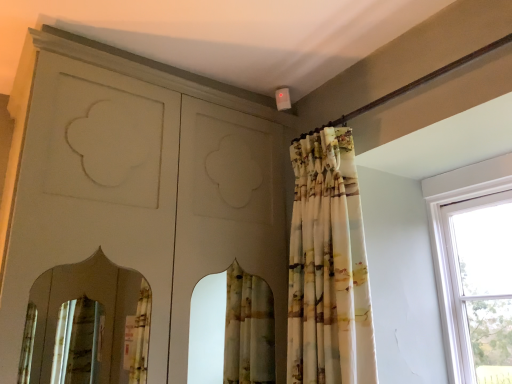
This screenshot has width=512, height=384. Find the location of `white matte screen door at upper center`. white matte screen door at upper center is located at coordinates (138, 185).

The width and height of the screenshot is (512, 384). What do you see at coordinates (138, 185) in the screenshot? I see `white matte screen door at upper center` at bounding box center [138, 185].

This screenshot has height=384, width=512. Find the location of `white matte screen door at upper center`. white matte screen door at upper center is located at coordinates (138, 185).